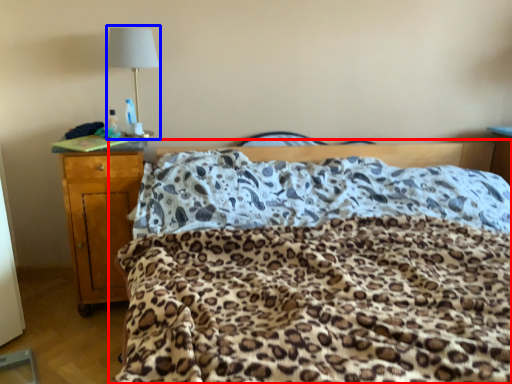
Question: Among these objects, which one is farthest to the camera, bed (highlighted by a red box) or lamp (highlighted by a blue box)?

Choices:
 (A) bed
 (B) lamp

Answer: (B)